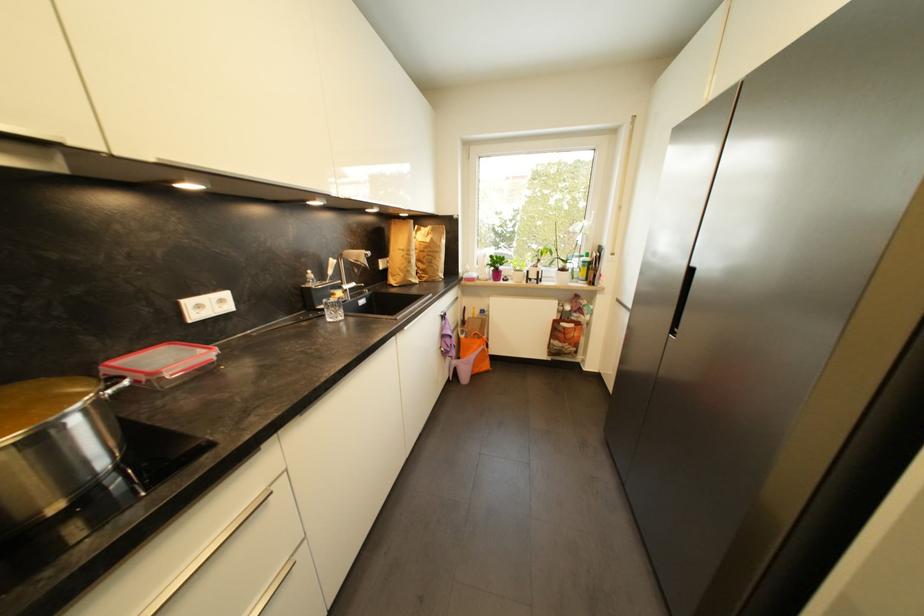
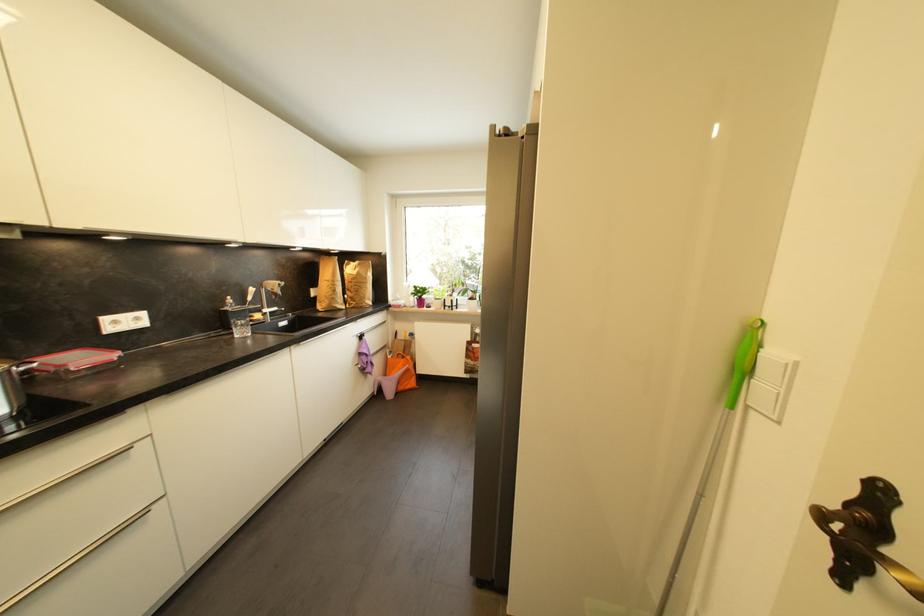
Where in the second image is the point corresponding to (226,302) from the first image?

(142, 321)